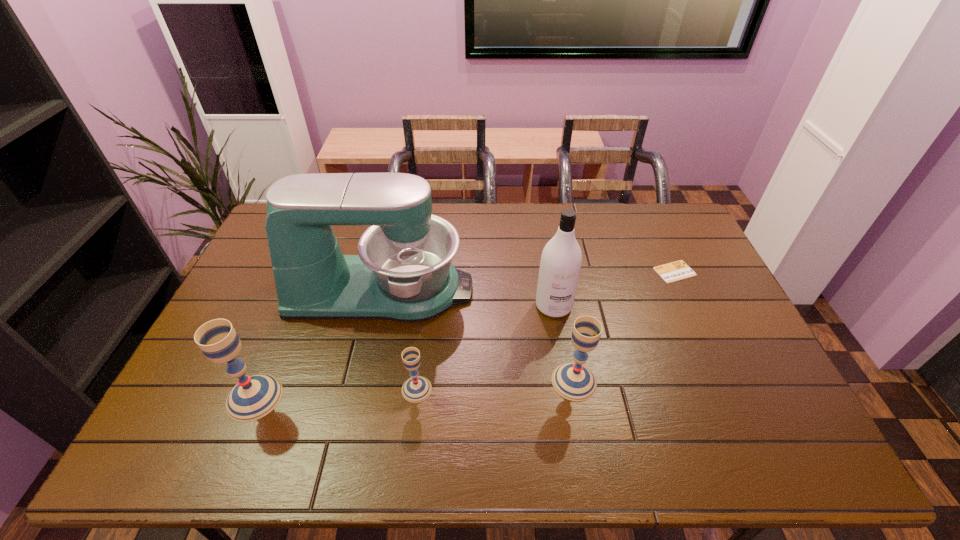
Locate an element on the screen. the leftmost chalice is located at coordinates (255, 396).

Where is `the fifth tallest object`? This screenshot has width=960, height=540. the fifth tallest object is located at coordinates (416, 389).

Where is `the shortest chalice`? The height and width of the screenshot is (540, 960). the shortest chalice is located at coordinates (416, 389).

This screenshot has height=540, width=960. I want to click on the third shortest object, so click(573, 381).

Where is `the rightmost chalice`? the rightmost chalice is located at coordinates (573, 381).

Locate an element on the screen. the rightmost object is located at coordinates (678, 270).

The height and width of the screenshot is (540, 960). I want to click on identity card, so click(x=678, y=270).

You are a GUI agent. You are given a task and a screenshot of the screen. Output one action in this format:
    pyautogui.click(x=<x>, y=<y>)
    Task: Click on the mixer
    
    Given the screenshot: What is the action you would take?
    pyautogui.click(x=403, y=272)

At what (x,y) coordinates should I click in order to perform the action: click on shampoo. Please return your answer as a coordinate pair (x, y). Looking at the image, I should click on (561, 259).

I want to click on free point located 0.050m on the back of the leftmost chalice, so click(271, 359).